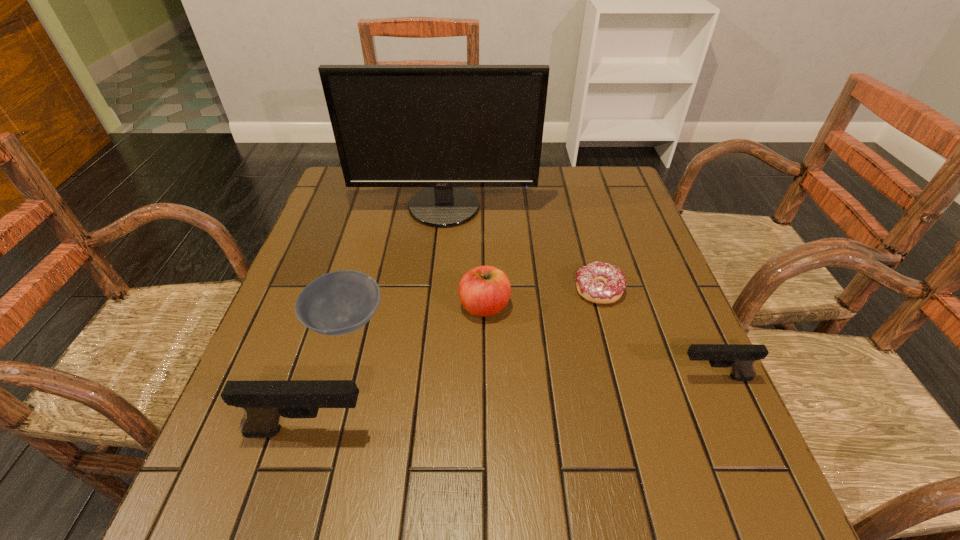
Identify the location of the nearer pistol. (264, 402).

This screenshot has height=540, width=960. What are the coordinates of `the left pistol` in the screenshot? It's located at (264, 402).

Where is `the right pistol`? Image resolution: width=960 pixels, height=540 pixels. the right pistol is located at coordinates (740, 357).

At what (x,y) coordinates should I click in order to perform the action: click on the fourth tallest object. Please return your answer as a coordinate pair (x, y). Looking at the image, I should click on (740, 357).

The height and width of the screenshot is (540, 960). Identify the location of the tallest object. (445, 127).

Where is `monitor`? monitor is located at coordinates (445, 127).

Identify the location of the fifth tallest object. (337, 303).

This screenshot has width=960, height=540. What are the coordinates of `apple` in the screenshot? It's located at (483, 291).

Find the location of a particular element. The height and width of the screenshot is (540, 960). the shortest object is located at coordinates (589, 278).

Identify the location of the fifth object from left to right. (589, 278).